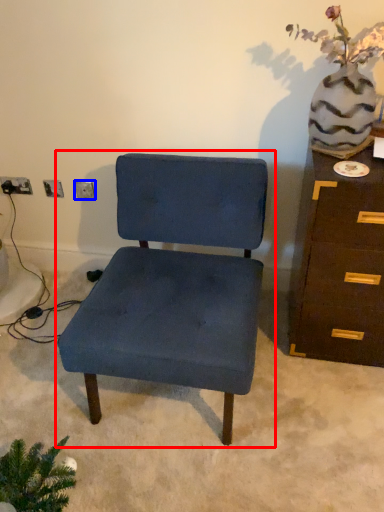
Question: Which point is further to the camera, chair (highlighted by a red box) or electric outlet (highlighted by a blue box)?

Choices:
 (A) chair
 (B) electric outlet

Answer: (B)